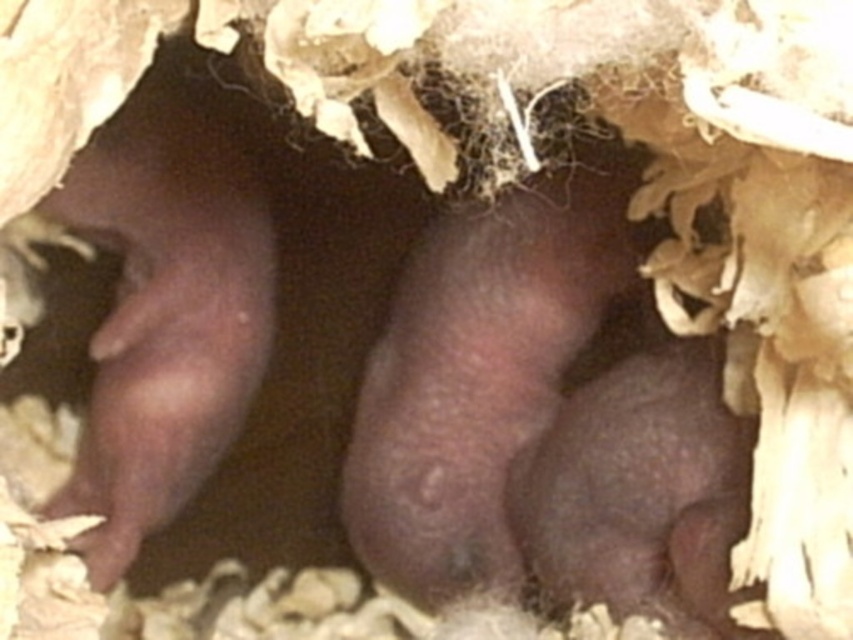
You are standing 1.24 meters away from the point at coordinates (215, 102) in the image. If you want to place a small food dish there, will it be within the burrow?

The point at coordinates (215, 102) is 1.24 meters away from you, so placing the food dish there would be within the burrow since the coordinates are part of the burrow environment described in the scene.

You are a small animal trying to navigate through the burrow. There are two points marked in the image, point 1 at coordinates point [440,508] and point 2 at coordinates point [676,408]. If you start moving from point 1, which direction should you go to reach point 2?

To move from point 1 at coordinates point [440,508] to point 2 at coordinates point [676,408], you should move downward and to the left since point 1 is closer to the viewer than point 2, which is further back in the burrow.

You are a veterinarian examining two baby hamsters in a burrow. The fuzzy dark brown hamster at center and the smooth dark brown hamster at left are both present. Which hamster is taller?

The smooth dark brown hamster at left is taller than the fuzzy dark brown hamster at center.